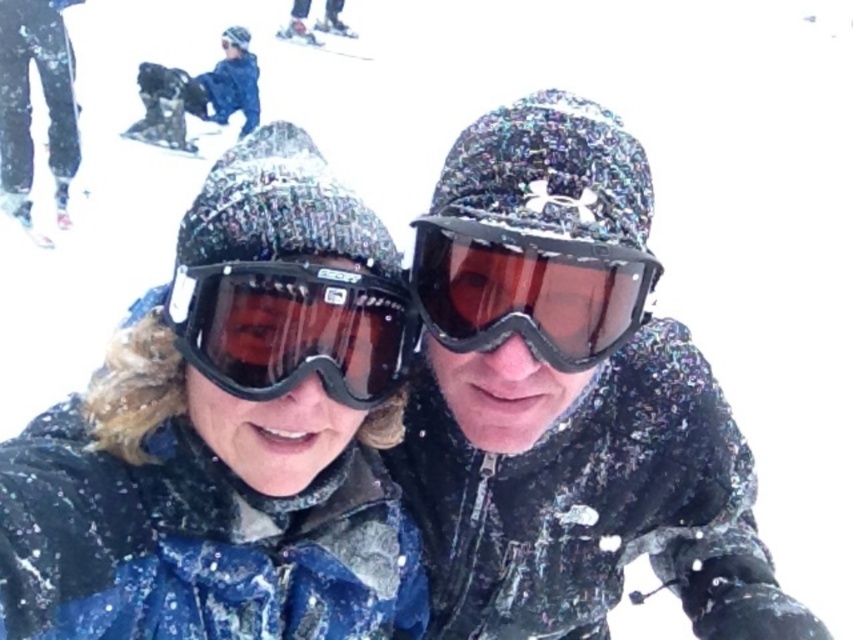
In the scene shown: You are a photographer trying to capture a closeup of the white plastic ski at upper center without including the matte black ski at left in the frame. Based on their positions, can you position yourself in a way to achieve this?

The matte black ski at left is positioned on the left side of the white plastic ski at upper center. By moving to the right side of the white plastic ski at upper center, you can position yourself to capture the white plastic ski at upper center without including the matte black ski at left in the frame.

You are a ski equipment inspector checking the skis in the image. The matte black ski at left and the white plastic ski at upper center are both for a child. Which one is more appropriate for a 6 year old?

The matte black ski at left is smaller than the white plastic ski at upper center, so the matte black ski at left is more appropriate for a 6 year old.